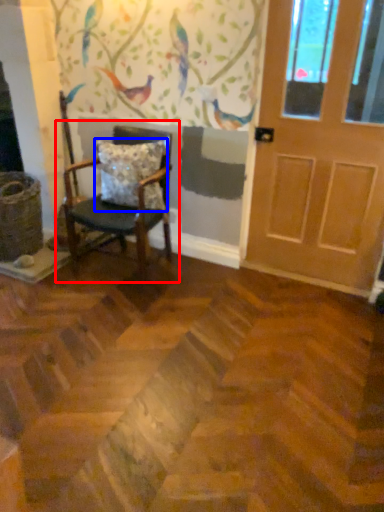
Question: Which point is further to the camera, chair (highlighted by a red box) or pillow (highlighted by a blue box)?

Choices:
 (A) chair
 (B) pillow

Answer: (B)